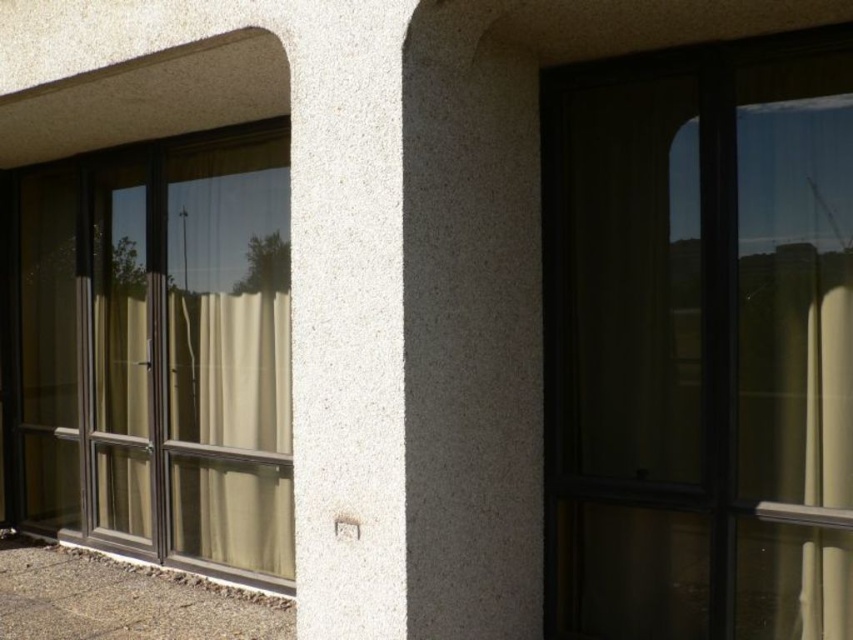
Question: Among these objects, which one is nearest to the camera?

Choices:
 (A) transparent glass window at right
 (B) transparent glass screen door at left

Answer: (A)

Question: Observing the image, what is the correct spatial positioning of transparent glass window at right in reference to transparent glass screen door at left?

Choices:
 (A) right
 (B) left

Answer: (A)

Question: Can you confirm if transparent glass window at right is positioned above transparent glass screen door at left?

Choices:
 (A) yes
 (B) no

Answer: (A)

Question: Is transparent glass window at right to the right of transparent glass screen door at left from the viewer's perspective?

Choices:
 (A) yes
 (B) no

Answer: (A)